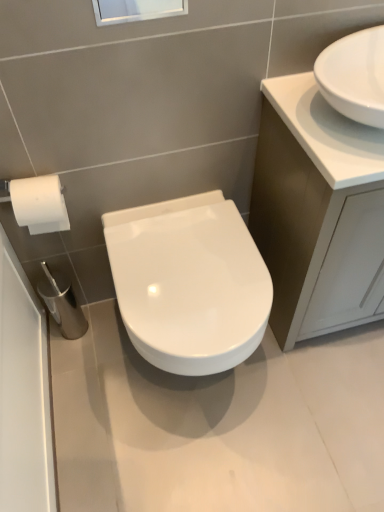
What is the approximate height of white glossy sink at upper right?

The height of white glossy sink at upper right is 4.18 inches.

Image resolution: width=384 pixels, height=512 pixels. What do you see at coordinates (326, 132) in the screenshot?
I see `white glossy sink at upper right` at bounding box center [326, 132].

The height and width of the screenshot is (512, 384). I want to click on white glossy toilet at center, so 189,283.

Is white glossy toilet at center taller or shorter than white glossy sink at upper right?

Considering their sizes, white glossy toilet at center has more height than white glossy sink at upper right.

Considering the sizes of white glossy toilet at center and white glossy sink at upper right in the image, is white glossy toilet at center wider or thinner than white glossy sink at upper right?

white glossy toilet at center is wider than white glossy sink at upper right.

Is there a large distance between white glossy toilet at center and white glossy sink at upper right?

No, white glossy toilet at center is not far from white glossy sink at upper right.

Is white glossy toilet at center positioned with its back to white glossy sink at upper right?

No, white glossy toilet at center is not facing away from white glossy sink at upper right.

Is white glossy toilet at center oriented away from white glossy cabinet at upper right?

No.

Looking at this image, considering the sizes of white glossy toilet at center and white glossy cabinet at upper right in the image, is white glossy toilet at center bigger or smaller than white glossy cabinet at upper right?

In the image, white glossy toilet at center appears to be smaller than white glossy cabinet at upper right.

From the image's perspective, is white glossy toilet at center on white glossy cabinet at upper right?

No, from the image's perspective, white glossy toilet at center is not over white glossy cabinet at upper right.

In terms of height, does white glossy toilet at center look taller or shorter compared to white glossy cabinet at upper right?

In the image, white glossy toilet at center appears to be shorter than white glossy cabinet at upper right.

Is white glossy cabinet at upper right not inside transparent glass window screen at upper center?

white glossy cabinet at upper right lies outside transparent glass window screen at upper center's area.

Can you confirm if white glossy cabinet at upper right is thinner than transparent glass window screen at upper center?

No.

Is white glossy cabinet at upper right at the left side of transparent glass window screen at upper center?

No.

Consider the image. Is white glossy cabinet at upper right facing towards transparent glass window screen at upper center?

No, white glossy cabinet at upper right is not facing towards transparent glass window screen at upper center.

From a real-world perspective, is white glossy cabinet at upper right physically below white glossy toilet at center?

Incorrect, from a real-world perspective, white glossy cabinet at upper right is higher than white glossy toilet at center.

Looking at this image, how much distance is there between white glossy cabinet at upper right and white glossy toilet at center?

They are 28.29 centimeters apart.

Is there a large distance between white glossy cabinet at upper right and white glossy toilet at center?

That's not correct — white glossy cabinet at upper right is a little close to white glossy toilet at center.

Does white glossy cabinet at upper right have a lesser width compared to white glossy toilet at center?

Correct, the width of white glossy cabinet at upper right is less than that of white glossy toilet at center.

From a real-world perspective, is transparent glass window screen at upper center on top of white glossy cabinet at upper right?

Correct, in the physical world, transparent glass window screen at upper center is higher than white glossy cabinet at upper right.

Does transparent glass window screen at upper center have a lesser width compared to white glossy cabinet at upper right?

Yes.

I want to click on window screen above the white glossy cabinet at upper right (from a real-world perspective), so click(136, 10).

Does point (96, 13) come behind point (270, 113)?

No, it is not.

Considering the sizes of transparent glass window screen at upper center and white glossy toilet at center in the image, is transparent glass window screen at upper center bigger or smaller than white glossy toilet at center?

Considering their sizes, transparent glass window screen at upper center takes up less space than white glossy toilet at center.

Do you think transparent glass window screen at upper center is within white glossy toilet at center, or outside of it?

transparent glass window screen at upper center is not inside white glossy toilet at center, it's outside.

From a real-world perspective, is transparent glass window screen at upper center physically located above or below white glossy toilet at center?

In terms of real-world spatial position, transparent glass window screen at upper center is above white glossy toilet at center.

Is white glossy cabinet at upper right wider than white glossy sink at upper right?

Correct, the width of white glossy cabinet at upper right exceeds that of white glossy sink at upper right.

In the scene shown: Which of these two, white glossy cabinet at upper right or white glossy sink at upper right, is smaller?

white glossy sink at upper right.

Which is correct: white glossy cabinet at upper right is inside white glossy sink at upper right, or outside of it?

white glossy cabinet at upper right is located beyond the bounds of white glossy sink at upper right.

Where is `counter top on the right side of white glossy toilet at center`? The width and height of the screenshot is (384, 512). counter top on the right side of white glossy toilet at center is located at coordinates (326, 132).

Identify the location of toilet behind the white glossy cabinet at upper right. This screenshot has height=512, width=384. (189, 283).

When comparing their distances from transparent glass window screen at upper center, does white glossy cabinet at upper right or white glossy sink at upper right seem further?

Among the two, white glossy cabinet at upper right is located further to transparent glass window screen at upper center.

When comparing their distances from white glossy toilet at center, does transparent glass window screen at upper center or white glossy sink at upper right seem further?

transparent glass window screen at upper center.

Considering their positions, is white glossy sink at upper right positioned closer to white glossy toilet at center than transparent glass window screen at upper center?

The object closer to white glossy toilet at center is white glossy sink at upper right.

Based on the photo, estimate the real-world distances between objects in this image. Which object is further from white glossy toilet at center, white glossy sink at upper right or white glossy cabinet at upper right?

white glossy sink at upper right is further to white glossy toilet at center.

Considering their positions, is white glossy cabinet at upper right positioned further to white glossy toilet at center than transparent glass window screen at upper center?

transparent glass window screen at upper center is positioned further to the anchor white glossy toilet at center.

Looking at the image, which one is located further to white glossy cabinet at upper right, transparent glass window screen at upper center or white glossy toilet at center?

transparent glass window screen at upper center is positioned further to the anchor white glossy cabinet at upper right.

Looking at the image, which one is located closer to white glossy cabinet at upper right, white glossy sink at upper right or transparent glass window screen at upper center?

Among the two, white glossy sink at upper right is located nearer to white glossy cabinet at upper right.

Which object lies nearer to the anchor point white glossy sink at upper right, transparent glass window screen at upper center or white glossy toilet at center?

The object closer to white glossy sink at upper right is white glossy toilet at center.

Find the location of a particular element. The width and height of the screenshot is (384, 512). counter top between transparent glass window screen at upper center and white glossy cabinet at upper right from left to right is located at coordinates (326, 132).

Identify the location of counter top between transparent glass window screen at upper center and white glossy toilet at center vertically. (326, 132).

Locate an element on the screen. Image resolution: width=384 pixels, height=512 pixels. counter top between white glossy toilet at center and white glossy cabinet at upper right in the horizontal direction is located at coordinates (326, 132).

This screenshot has width=384, height=512. Identify the location of toilet between transparent glass window screen at upper center and white glossy cabinet at upper right in the horizontal direction. (189, 283).